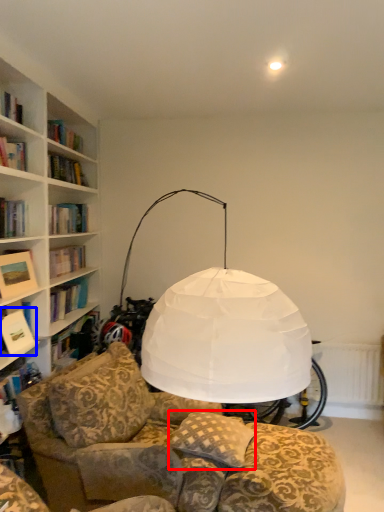
Question: Which point is closer to the camera, pillow (highlighted by a red box) or book (highlighted by a blue box)?

Choices:
 (A) pillow
 (B) book

Answer: (A)